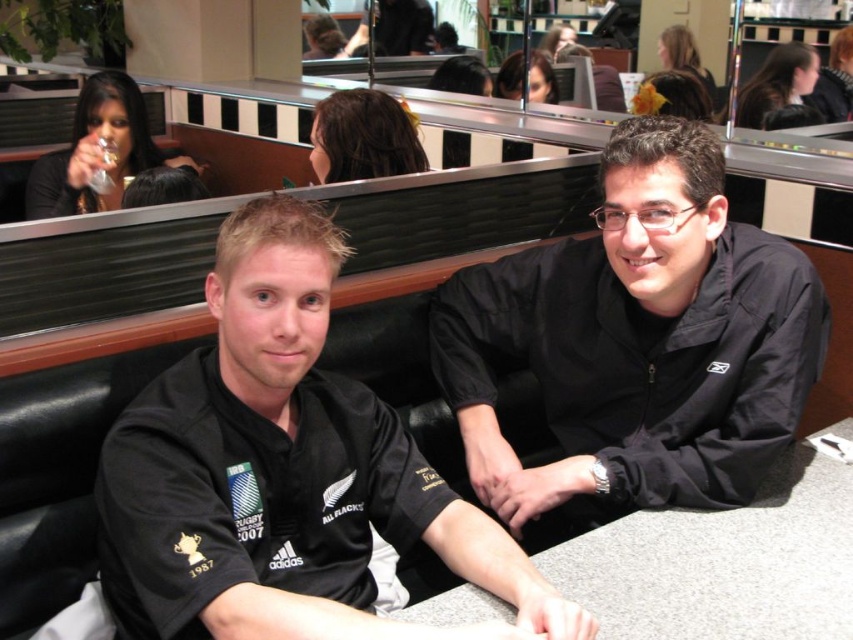
Question: Can you confirm if black jersey at center is bigger than gray laminate table at center?

Choices:
 (A) no
 (B) yes

Answer: (B)

Question: Which of the following is the farthest from the observer?

Choices:
 (A) (426, 474)
 (B) (811, 456)
 (C) (726, 458)

Answer: (B)

Question: Is the position of black jersey at center more distant than that of gray laminate table at center?

Choices:
 (A) yes
 (B) no

Answer: (B)

Question: Does black jersey at center appear on the left side of gray laminate table at center?

Choices:
 (A) yes
 (B) no

Answer: (A)

Question: Considering the real-world distances, which object is farthest from the black jersey at center?

Choices:
 (A) gray laminate table at center
 (B) black matte jacket at center

Answer: (B)

Question: Which point appears closest to the camera in this image?

Choices:
 (A) (699, 552)
 (B) (451, 358)
 (C) (161, 625)

Answer: (C)